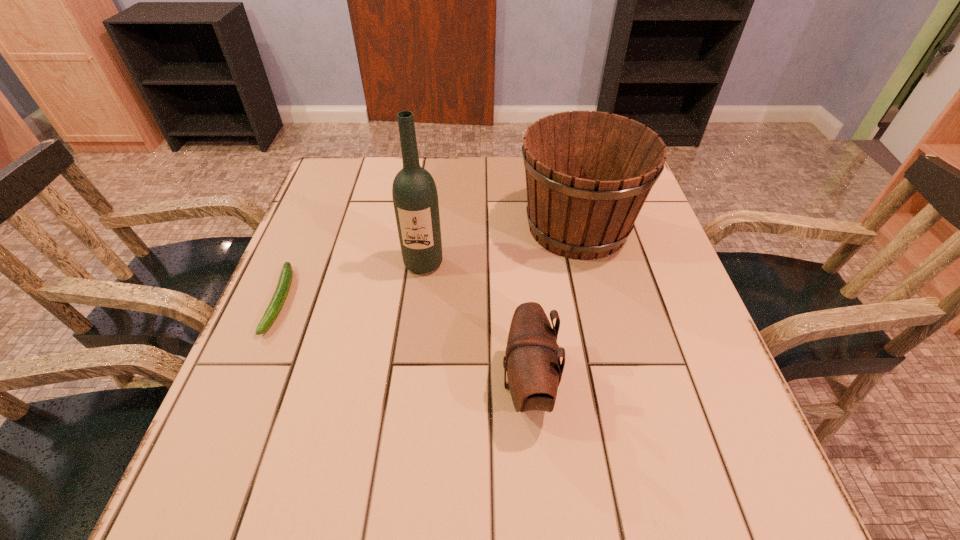
Where is `blank space at the right edge of the desktop`? The height and width of the screenshot is (540, 960). blank space at the right edge of the desktop is located at coordinates (704, 329).

Where is `vacant space at the far left corner of the desktop`? This screenshot has width=960, height=540. vacant space at the far left corner of the desktop is located at coordinates (331, 174).

Image resolution: width=960 pixels, height=540 pixels. In order to click on free space at the near right corner of the desktop in this screenshot , I will do `click(674, 486)`.

Find the location of a particular element. The width and height of the screenshot is (960, 540). vacant point located between the tallest object and the pouch is located at coordinates (475, 324).

Identify the location of free spot between the leftmost object and the pouch. (404, 343).

Where is `free space between the tallest object and the third shortest object`? The image size is (960, 540). free space between the tallest object and the third shortest object is located at coordinates (500, 245).

The image size is (960, 540). In order to click on empty space between the third tallest object and the wine bucket in this screenshot , I will do `click(552, 306)`.

Locate an element on the screen. Image resolution: width=960 pixels, height=540 pixels. unoccupied area between the shortest object and the tallest object is located at coordinates (352, 282).

What are the coordinates of `vacant space in between the third tallest object and the second object from left to right` in the screenshot? It's located at (475, 324).

This screenshot has width=960, height=540. In order to click on vacant point located between the wine bucket and the tallest object in this screenshot , I will do `click(500, 245)`.